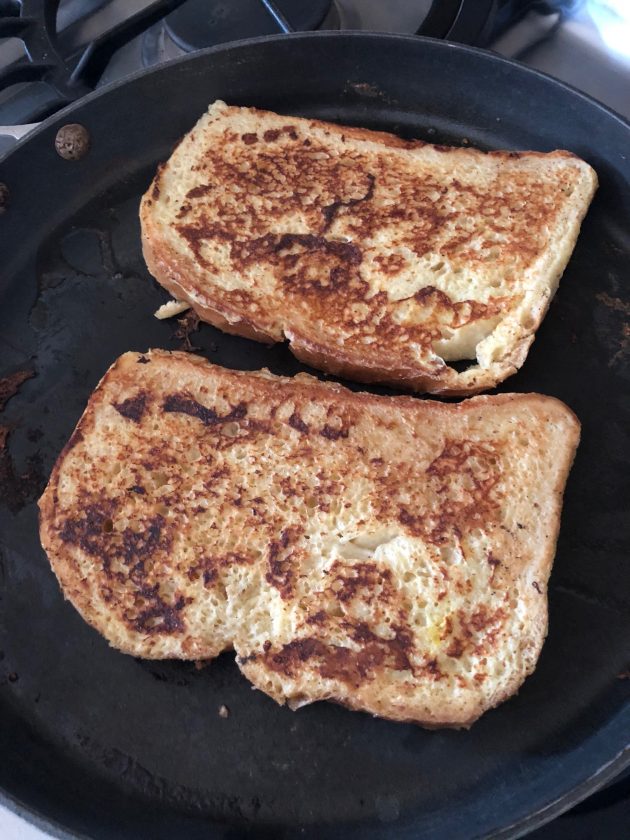
Find the location of a particular element. burner metal frame is located at coordinates (100, 40).